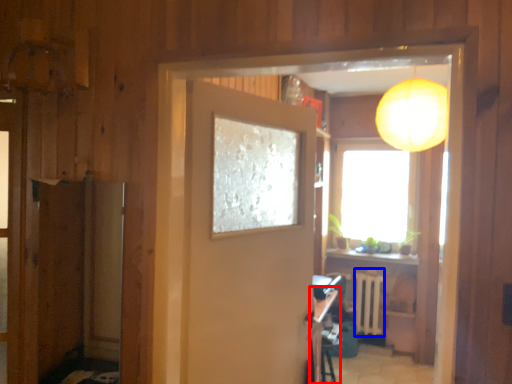
Question: Which object is further to the camera taking this photo, table (highlighted by a red box) or radiator (highlighted by a blue box)?

Choices:
 (A) table
 (B) radiator

Answer: (B)